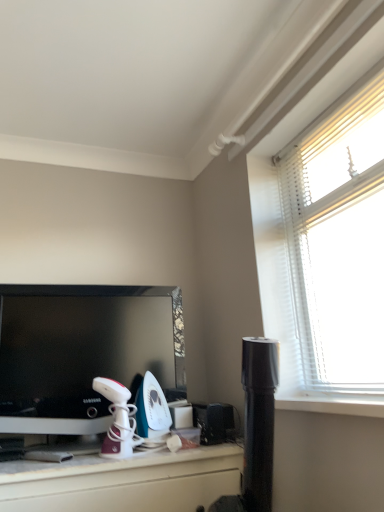
Question: Are black plastic speaker at lower center, which ranks as the third appliance in left-to-right order, and white glossy iron at center, arranged as the third appliance when viewed from the right, far apart?

Choices:
 (A) yes
 (B) no

Answer: (B)

Question: Does black plastic speaker at lower center, arranged as the first appliance when viewed from the right, have a smaller size compared to white glossy iron at center, marked as the first appliance in a left-to-right arrangement?

Choices:
 (A) no
 (B) yes

Answer: (B)

Question: Considering the relative sizes of black plastic speaker at lower center, arranged as the first appliance when viewed from the right, and white glossy iron at center, arranged as the third appliance when viewed from the right, in the image provided, is black plastic speaker at lower center, arranged as the first appliance when viewed from the right, thinner than white glossy iron at center, arranged as the third appliance when viewed from the right,?

Choices:
 (A) no
 (B) yes

Answer: (B)

Question: Is black plastic speaker at lower center, which ranks as the third appliance in left-to-right order, further to camera compared to white glossy iron at center, marked as the first appliance in a left-to-right arrangement?

Choices:
 (A) no
 (B) yes

Answer: (B)

Question: Can you confirm if black plastic speaker at lower center, arranged as the first appliance when viewed from the right, is bigger than white glossy iron at center, marked as the first appliance in a left-to-right arrangement?

Choices:
 (A) yes
 (B) no

Answer: (B)

Question: Is black plastic speaker at lower center, which ranks as the third appliance in left-to-right order, beside white glossy iron at center, arranged as the third appliance when viewed from the right?

Choices:
 (A) no
 (B) yes

Answer: (A)

Question: From the image's perspective, would you say teal glossy iron at center, acting as the 2th appliance starting from the right, is positioned over black glossy television at left?

Choices:
 (A) no
 (B) yes

Answer: (A)

Question: Is teal glossy iron at center, the second appliance positioned from the left, aimed at black glossy television at left?

Choices:
 (A) no
 (B) yes

Answer: (A)

Question: From a real-world perspective, is teal glossy iron at center, the second appliance positioned from the left, under black glossy television at left?

Choices:
 (A) yes
 (B) no

Answer: (A)

Question: Considering the relative positions of teal glossy iron at center, the second appliance positioned from the left, and black glossy television at left in the image provided, is teal glossy iron at center, the second appliance positioned from the left, to the left of black glossy television at left from the viewer's perspective?

Choices:
 (A) yes
 (B) no

Answer: (B)

Question: Can you confirm if teal glossy iron at center, the second appliance positioned from the left, is smaller than black glossy television at left?

Choices:
 (A) yes
 (B) no

Answer: (A)

Question: Is teal glossy iron at center, the second appliance positioned from the left, not close to black glossy television at left?

Choices:
 (A) no
 (B) yes

Answer: (A)

Question: From a real-world perspective, is teal glossy iron at center, the second appliance positioned from the left, below white glossy iron at center, marked as the first appliance in a left-to-right arrangement?

Choices:
 (A) yes
 (B) no

Answer: (B)